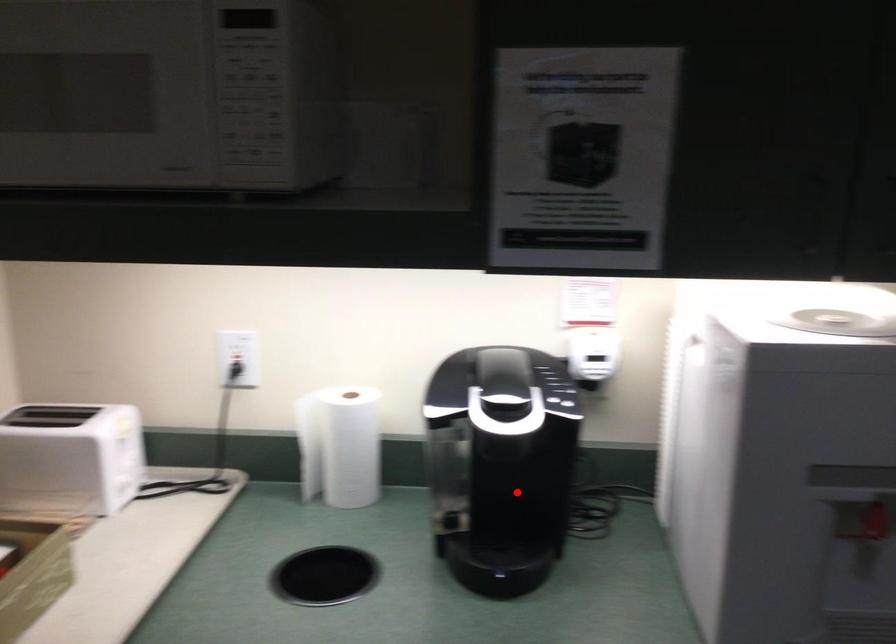
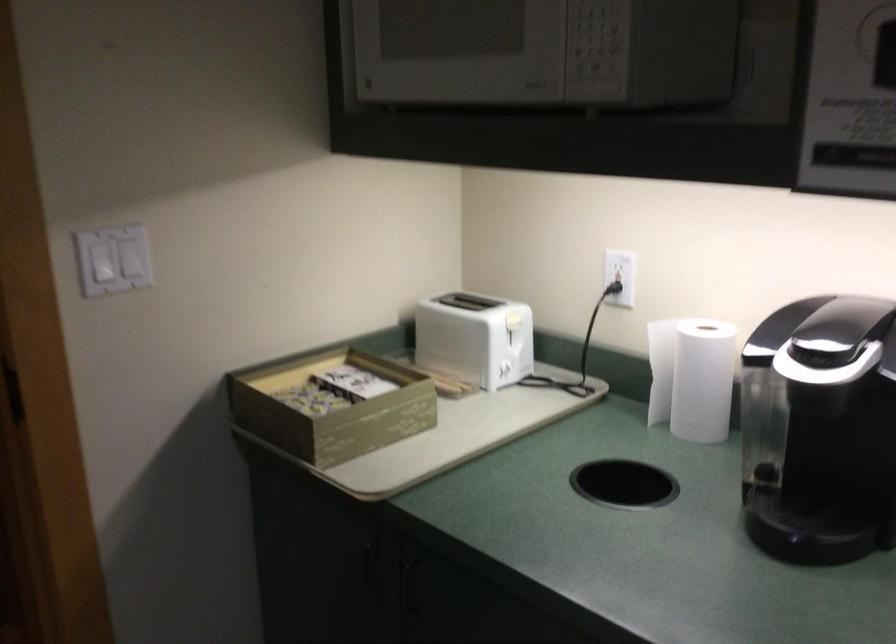
In the second image, find the point that corresponds to the highlighted location in the first image.

(839, 458)